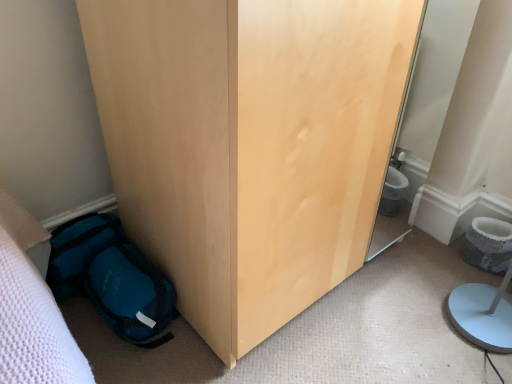
Question: Is gray textured toilet bowl at lower right in front of teal fabric backpack at lower left?

Choices:
 (A) yes
 (B) no

Answer: (B)

Question: Is gray textured toilet bowl at lower right further to camera compared to teal fabric backpack at lower left?

Choices:
 (A) yes
 (B) no

Answer: (A)

Question: Is gray textured toilet bowl at lower right not near teal fabric backpack at lower left?

Choices:
 (A) yes
 (B) no

Answer: (A)

Question: Considering the relative sizes of gray textured toilet bowl at lower right and teal fabric backpack at lower left in the image provided, is gray textured toilet bowl at lower right thinner than teal fabric backpack at lower left?

Choices:
 (A) no
 (B) yes

Answer: (B)

Question: Considering the relative positions of gray textured toilet bowl at lower right and teal fabric backpack at lower left in the image provided, is gray textured toilet bowl at lower right to the left of teal fabric backpack at lower left from the viewer's perspective?

Choices:
 (A) yes
 (B) no

Answer: (B)

Question: From a real-world perspective, is gray textured toilet bowl at lower right located beneath teal fabric backpack at lower left?

Choices:
 (A) yes
 (B) no

Answer: (A)

Question: From the image's perspective, is gray textured toilet bowl at lower right on matte wood wardrobe at lower left?

Choices:
 (A) no
 (B) yes

Answer: (A)

Question: Is gray textured toilet bowl at lower right aimed at matte wood wardrobe at lower left?

Choices:
 (A) yes
 (B) no

Answer: (B)

Question: Is gray textured toilet bowl at lower right behind matte wood wardrobe at lower left?

Choices:
 (A) yes
 (B) no

Answer: (A)

Question: Considering the relative positions of gray textured toilet bowl at lower right and matte wood wardrobe at lower left in the image provided, is gray textured toilet bowl at lower right to the right of matte wood wardrobe at lower left from the viewer's perspective?

Choices:
 (A) yes
 (B) no

Answer: (A)

Question: Does gray textured toilet bowl at lower right have a lesser height compared to matte wood wardrobe at lower left?

Choices:
 (A) no
 (B) yes

Answer: (B)

Question: Would you say matte wood wardrobe at lower left is part of gray textured toilet bowl at lower right's contents?

Choices:
 (A) no
 (B) yes

Answer: (A)

Question: Can you confirm if matte wood wardrobe at lower left is bigger than teal fabric backpack at lower left?

Choices:
 (A) no
 (B) yes

Answer: (B)